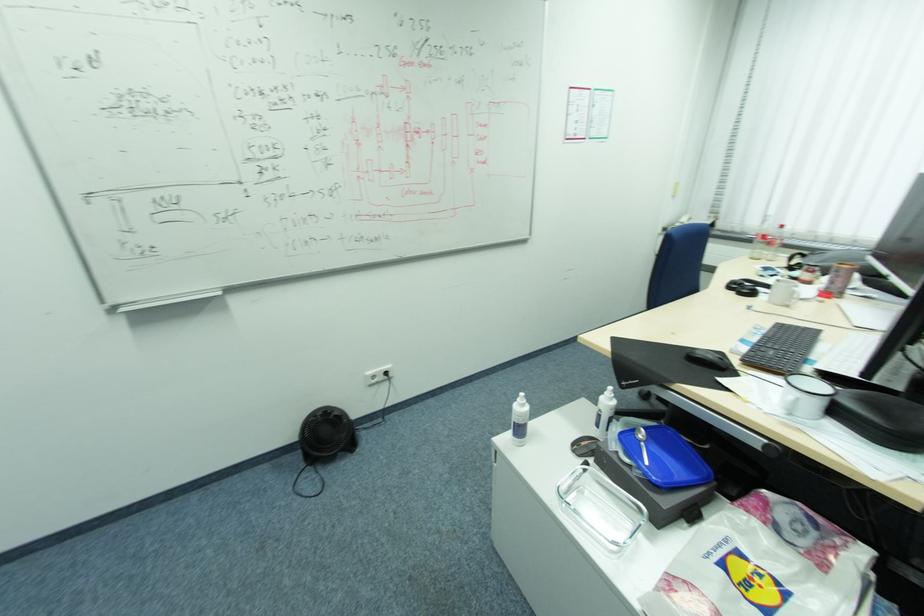
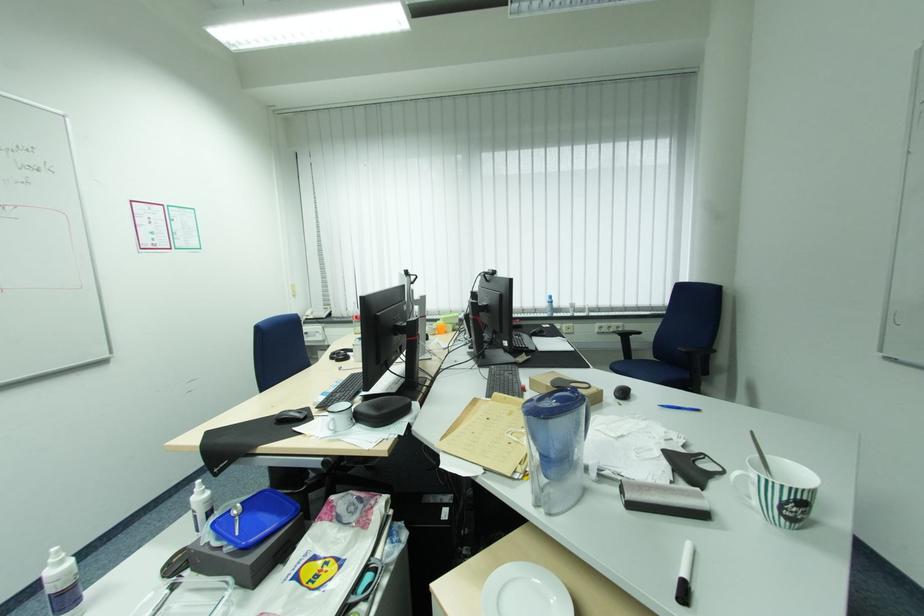
Find the pixel in the second image that matches point 553,355 in the first image.

(193, 487)